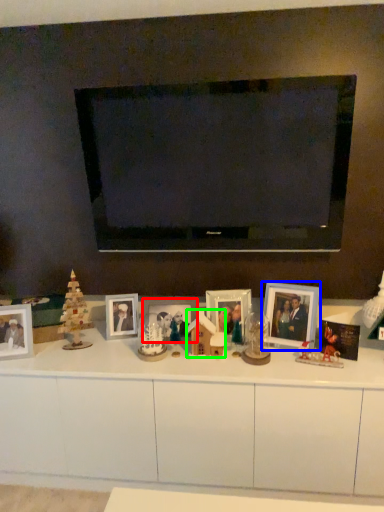
Question: Estimate the real-world distances between objects in this image. Which object is closer to picture frame (highlighted by a red box), picture frame (highlighted by a blue box) or toy (highlighted by a green box)?

Choices:
 (A) picture frame
 (B) toy

Answer: (B)